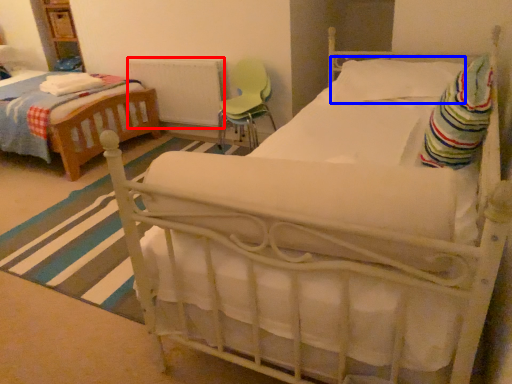
Question: Which object appears farthest to the camera in this image, radiator (highlighted by a red box) or pillow (highlighted by a blue box)?

Choices:
 (A) radiator
 (B) pillow

Answer: (A)